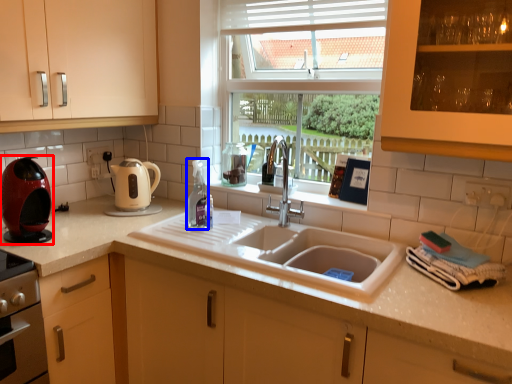
Question: Which object appears farthest to the camera in this image, kitchen appliance (highlighted by a red box) or bottle (highlighted by a blue box)?

Choices:
 (A) kitchen appliance
 (B) bottle

Answer: (B)